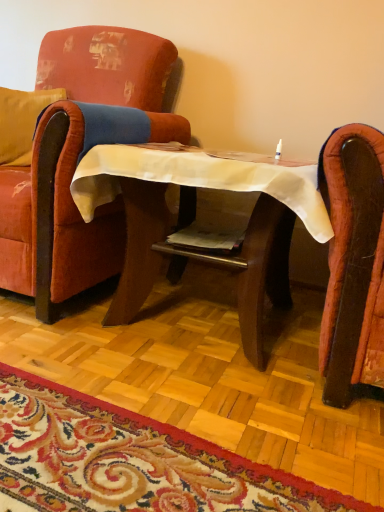
Question: From the image's perspective, is carpet with floral pattern at lower center above or below velvet red armchair at left?

Choices:
 (A) below
 (B) above

Answer: (A)

Question: Based on their positions, is carpet with floral pattern at lower center located to the left or right of velvet red armchair at left?

Choices:
 (A) left
 (B) right

Answer: (B)

Question: Considering the real-world distances, which object is closest to the velvet yellow pillow at left?

Choices:
 (A) velvet red armchair at left
 (B) carpet with floral pattern at lower center
 (C) wooden table at center

Answer: (A)

Question: Which of these objects is positioned closest to the velvet red armchair at left?

Choices:
 (A) carpet with floral pattern at lower center
 (B) velvet yellow pillow at left
 (C) wooden table at center

Answer: (C)